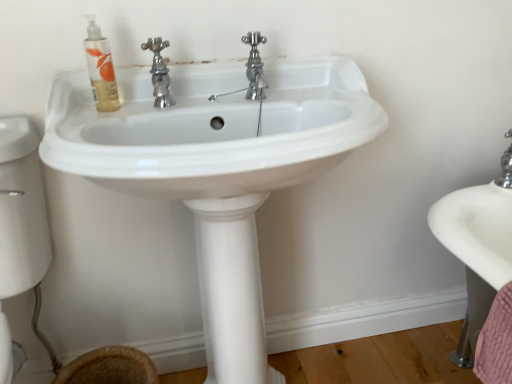
Question: From the image's perspective, is brown woven basket at lower left located above or below translucent gel mouthwash at upper left?

Choices:
 (A) below
 (B) above

Answer: (A)

Question: Is brown woven basket at lower left situated inside translucent gel mouthwash at upper left or outside?

Choices:
 (A) inside
 (B) outside

Answer: (B)

Question: Estimate the real-world distances between objects in this image. Which object is closer to the brown woven basket at lower left?

Choices:
 (A) white glossy sink at center
 (B) translucent gel mouthwash at upper left

Answer: (A)

Question: Which is farther from the white glossy sink at center?

Choices:
 (A) brown woven basket at lower left
 (B) translucent gel mouthwash at upper left

Answer: (A)